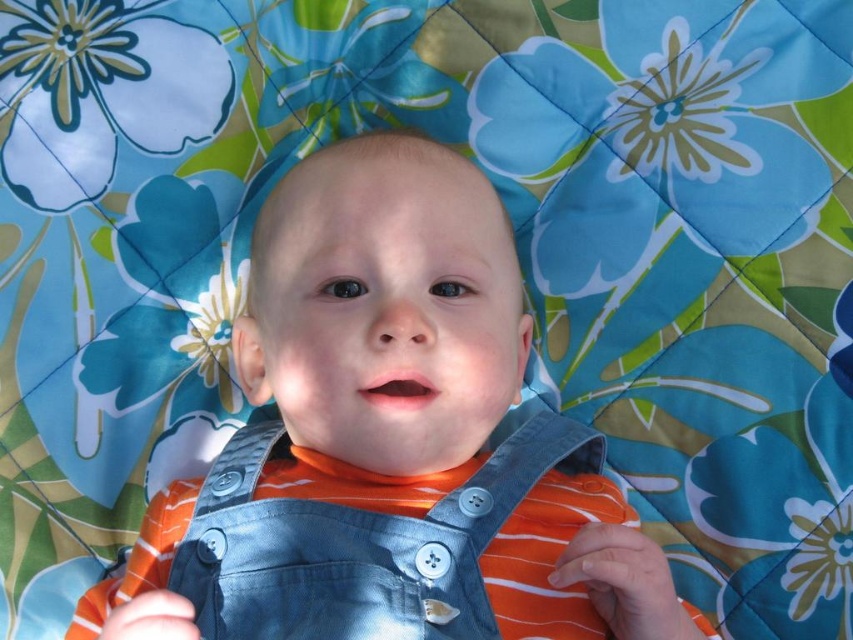
Is denim overalls at center wider than denim bib at center?

Correct, the width of denim overalls at center exceeds that of denim bib at center.

Measure the distance between denim overalls at center and camera.

denim overalls at center and camera are 25.05 inches apart from each other.

Where is `denim overalls at center`? Image resolution: width=853 pixels, height=640 pixels. denim overalls at center is located at coordinates coord(389,442).